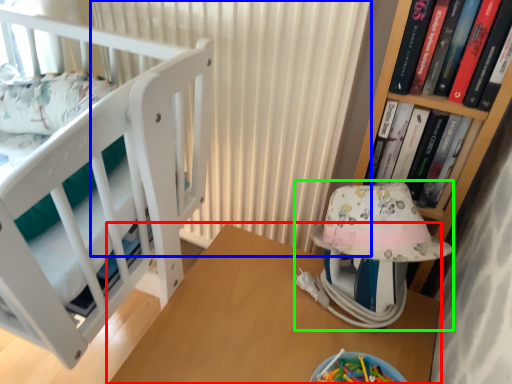
Question: Based on their relative distances, which object is nearer to table (highlighted by a red box)? Choose from curtain (highlighted by a blue box) and baby carriage (highlighted by a green box).

Choices:
 (A) curtain
 (B) baby carriage

Answer: (B)